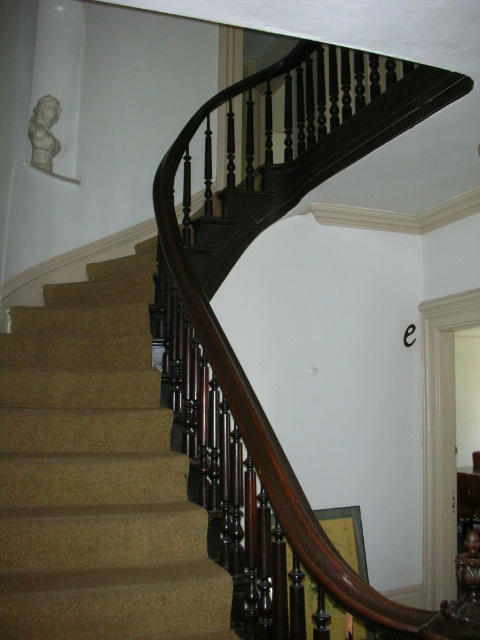
Question: Is the position of carpeted stairs at center less distant than that of white marble bust at upper left?

Choices:
 (A) yes
 (B) no

Answer: (A)

Question: Does dark wood baluster at center appear over carpeted stairs at center?

Choices:
 (A) no
 (B) yes

Answer: (B)

Question: Which of these objects is positioned farthest from the white marble bust at upper left?

Choices:
 (A) carpeted stairs at center
 (B) dark wood baluster at center

Answer: (A)

Question: Which object is closer to the camera taking this photo?

Choices:
 (A) white marble bust at upper left
 (B) dark wood baluster at center
 (C) carpeted stairs at center

Answer: (B)

Question: Which point is farther from the camera taking this photo?

Choices:
 (A) (183, 550)
 (B) (43, 99)

Answer: (B)

Question: Is carpeted stairs at center in front of white marble bust at upper left?

Choices:
 (A) yes
 (B) no

Answer: (A)